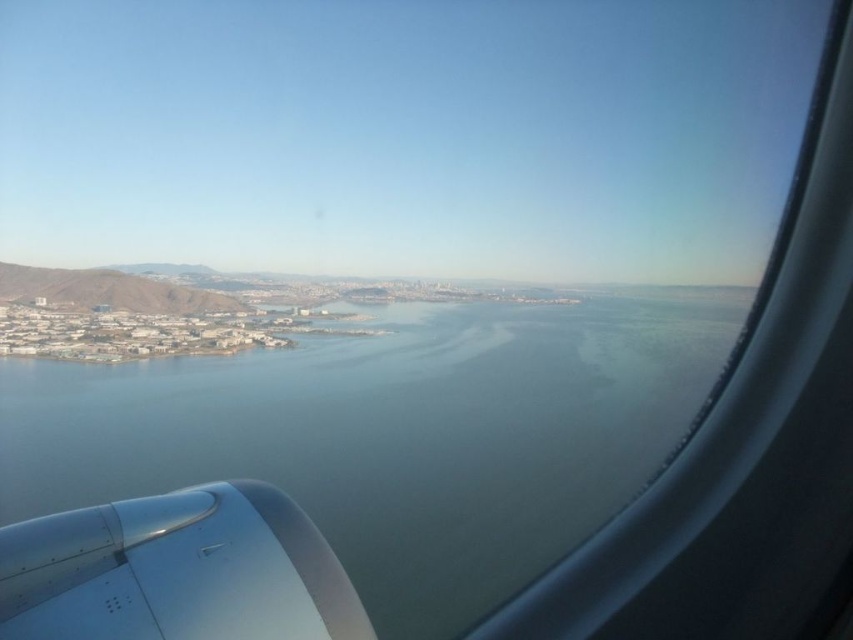
You are a passenger sitting by the window and want to know if the clear blue water at center is wider than the silver metallic engine at lower left. Can you confirm this based on the view?

The clear blue water at center is wider than the silver metallic engine at lower left according to the description.